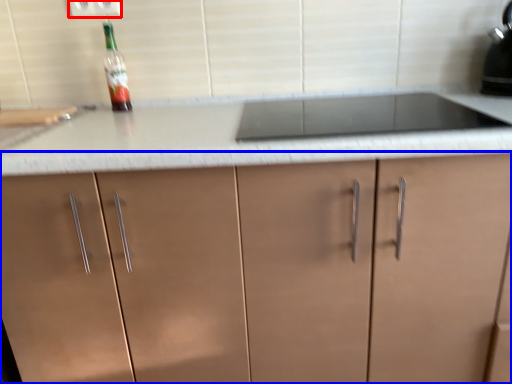
Question: Among these objects, which one is nearest to the camera, electric outlet (highlighted by a red box) or cabinetry (highlighted by a blue box)?

Choices:
 (A) electric outlet
 (B) cabinetry

Answer: (B)